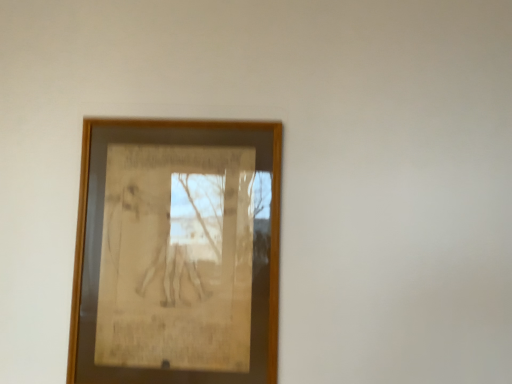
Measure the distance between point (132, 284) and camera.

A distance of 3.64 feet exists between point (132, 284) and camera.

This screenshot has height=384, width=512. Identify the location of wooden picture frame at upper center. (170, 252).

This screenshot has width=512, height=384. Describe the element at coordinates (170, 252) in the screenshot. I see `wooden picture frame at upper center` at that location.

What is the approximate width of wooden picture frame at upper center?

wooden picture frame at upper center is 1.27 inches in width.

This screenshot has height=384, width=512. Identify the location of wooden picture frame at upper center. (170, 252).